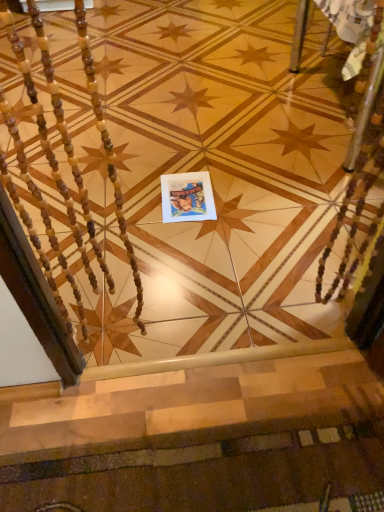
Describe the element at coordinates (187, 197) in the screenshot. I see `matte paper postcard at center` at that location.

At what (x,y) coordinates should I click in order to perform the action: click on matte paper postcard at center. Please return your answer as a coordinate pair (x, y). Image resolution: width=384 pixels, height=512 pixels. Looking at the image, I should click on (187, 197).

What do you see at coordinates (202, 435) in the screenshot?
I see `carpeted stairs at lower center` at bounding box center [202, 435].

In order to face carpeted stairs at lower center, should I rotate leftwards or rightwards?

You should rotate right by 1.740 degrees.

Where is `carpeted stairs at lower center`? This screenshot has height=512, width=384. carpeted stairs at lower center is located at coordinates (202, 435).

At what (x,y) coordinates should I click in order to perform the action: click on matte paper postcard at center. Please return your answer as a coordinate pair (x, y). The width and height of the screenshot is (384, 512). Looking at the image, I should click on (187, 197).

Considering the relative positions of matte paper postcard at center and carpeted stairs at lower center in the image provided, is matte paper postcard at center to the right of carpeted stairs at lower center from the viewer's perspective?

In fact, matte paper postcard at center is to the left of carpeted stairs at lower center.

Is matte paper postcard at center positioned before carpeted stairs at lower center?

No, the depth of matte paper postcard at center is greater than that of carpeted stairs at lower center.

Is point (209, 211) positioned behind point (239, 355)?

That is True.

From the image's perspective, would you say matte paper postcard at center is positioned over carpeted stairs at lower center?

Yes, from the image's perspective, matte paper postcard at center is on top of carpeted stairs at lower center.

From a real-world perspective, which is physically below, matte paper postcard at center or carpeted stairs at lower center?

In real-world perspective, matte paper postcard at center is lower.

Based on the photo, is matte paper postcard at center wider than carpeted stairs at lower center?

Yes, matte paper postcard at center is wider than carpeted stairs at lower center.

Is matte paper postcard at center shorter than carpeted stairs at lower center?

Incorrect, the height of matte paper postcard at center does not fall short of that of carpeted stairs at lower center.

Is matte paper postcard at center bigger or smaller than carpeted stairs at lower center?

matte paper postcard at center is smaller than carpeted stairs at lower center.

Looking at this image, which is correct: matte paper postcard at center is inside carpeted stairs at lower center, or outside of it?

matte paper postcard at center cannot be found inside carpeted stairs at lower center.

Would you consider matte paper postcard at center to be distant from carpeted stairs at lower center?

No, there isn't a large distance between matte paper postcard at center and carpeted stairs at lower center.

Does matte paper postcard at center turn towards carpeted stairs at lower center?

Yes, matte paper postcard at center is aimed at carpeted stairs at lower center.

How distant is matte paper postcard at center from carpeted stairs at lower center?

A distance of 30.81 inches exists between matte paper postcard at center and carpeted stairs at lower center.

The height and width of the screenshot is (512, 384). What are the coordinates of `postcard below the carpeted stairs at lower center (from a real-world perspective)` in the screenshot? It's located at point(187,197).

Considering the relative positions of carpeted stairs at lower center and matte paper postcard at center in the image provided, is carpeted stairs at lower center to the right of matte paper postcard at center from the viewer's perspective?

Indeed, carpeted stairs at lower center is positioned on the right side of matte paper postcard at center.

Is carpeted stairs at lower center positioned in front of matte paper postcard at center?

Yes, carpeted stairs at lower center is closer to the viewer.

Is point (199, 469) more distant than point (211, 193)?

No.

From the image's perspective, does carpeted stairs at lower center appear lower than matte paper postcard at center?

Indeed, from the image's perspective, carpeted stairs at lower center is shown beneath matte paper postcard at center.

From a real-world perspective, is carpeted stairs at lower center over matte paper postcard at center?

Yes, from a real-world perspective, carpeted stairs at lower center is above matte paper postcard at center.

Can you confirm if carpeted stairs at lower center is thinner than matte paper postcard at center?

Yes, carpeted stairs at lower center is thinner than matte paper postcard at center.

Who is shorter, carpeted stairs at lower center or matte paper postcard at center?

Standing shorter between the two is carpeted stairs at lower center.

Is carpeted stairs at lower center smaller than matte paper postcard at center?

No, carpeted stairs at lower center is not smaller than matte paper postcard at center.

Do you think carpeted stairs at lower center is within matte paper postcard at center, or outside of it?

carpeted stairs at lower center exists outside the volume of matte paper postcard at center.

Would you say carpeted stairs at lower center is a long distance from matte paper postcard at center?

They are positioned close to each other.

Is carpeted stairs at lower center turned away from matte paper postcard at center?

Yes, carpeted stairs at lower center is facing away from matte paper postcard at center.

How different are the orientations of carpeted stairs at lower center and matte paper postcard at center in degrees?

The angle between the facing direction of carpeted stairs at lower center and the facing direction of matte paper postcard at center is 2.14 degrees.

Where is `postcard on the left side of carpeted stairs at lower center`? This screenshot has height=512, width=384. postcard on the left side of carpeted stairs at lower center is located at coordinates (187, 197).

Where is `stairs that is in front of the matte paper postcard at center`? Image resolution: width=384 pixels, height=512 pixels. stairs that is in front of the matte paper postcard at center is located at coordinates [202, 435].

The width and height of the screenshot is (384, 512). Find the location of `postcard on the left of the carpeted stairs at lower center`. postcard on the left of the carpeted stairs at lower center is located at coordinates (187, 197).